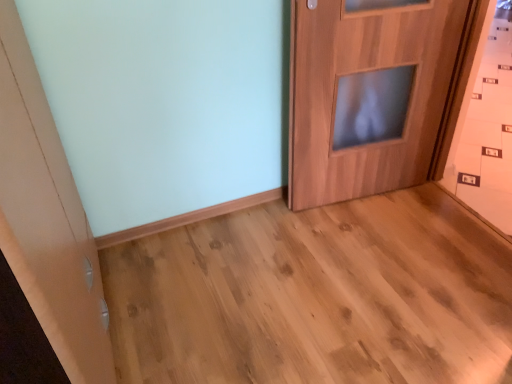
This screenshot has width=512, height=384. What are the coordinates of `free spot to the left of wooden door at center` in the screenshot? It's located at (266, 234).